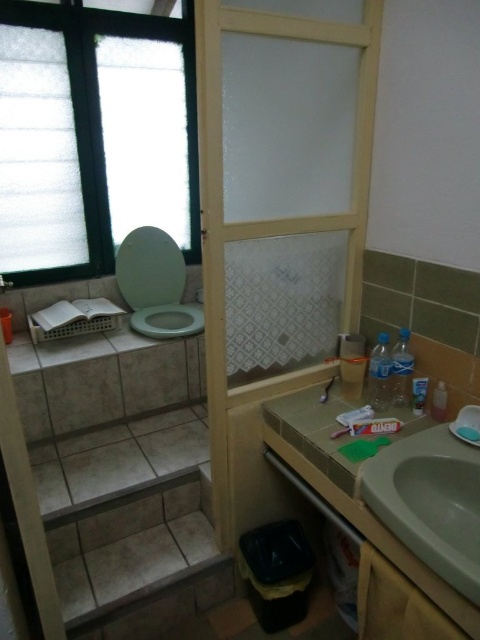
Question: Is white frosted glass window at upper left positioned at the back of translucent plastic toothbrush at sink right?

Choices:
 (A) yes
 (B) no

Answer: (A)

Question: Which object is positioned closest to the green matte toilet at left?

Choices:
 (A) white glossy sink at lower right
 (B) translucent plastic toothpaste tube at lower right
 (C) matte silver faucet at sink right

Answer: (C)

Question: Can you confirm if translucent plastic toothbrush at sink right is positioned to the right of translucent plastic toothpaste tube at lower right?

Choices:
 (A) yes
 (B) no

Answer: (A)

Question: Estimate the real-world distances between objects in this image. Which object is closer to the matte silver faucet at sink right?

Choices:
 (A) translucent plastic toothpaste tube at lower right
 (B) translucent wood screen door at center

Answer: (B)

Question: Which point is closer to the camera taking this photo?

Choices:
 (A) (343, 358)
 (B) (1, 289)

Answer: (A)

Question: Is white frosted glass window at upper left in front of translucent plastic toothbrush at center?

Choices:
 (A) no
 (B) yes

Answer: (A)